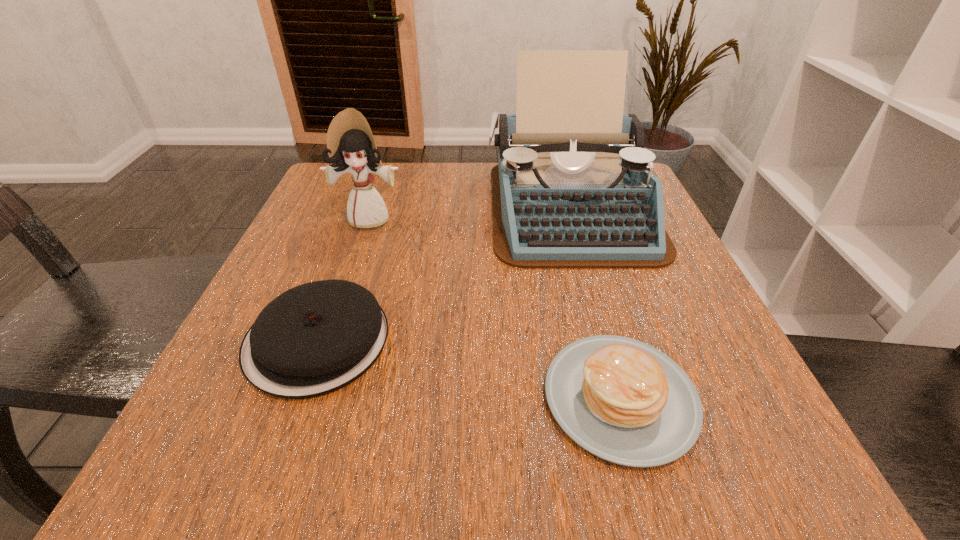
Find the location of a particular element. The image size is (960, 540). typewriter is located at coordinates coord(573,188).

Where is `the third shortest object`? the third shortest object is located at coordinates (350, 144).

The width and height of the screenshot is (960, 540). I want to click on the third tallest object, so click(316, 338).

The width and height of the screenshot is (960, 540). I want to click on the left pancake, so click(x=316, y=338).

Image resolution: width=960 pixels, height=540 pixels. Identify the location of the shortest object. (624, 401).

Locate an element on the screen. the right pancake is located at coordinates (624, 401).

You are a GUI agent. You are given a task and a screenshot of the screen. Output one action in this format:
    pyautogui.click(x=<x>, y=<y>)
    Task: Click on the free region located 0.100m on the typing side of the typewriter
    This screenshot has height=540, width=960.
    Given the screenshot: What is the action you would take?
    click(x=598, y=307)

In order to click on vacant space located 0.300m at the front face of the third shortest object in this screenshot , I will do `click(327, 346)`.

I want to click on free space located on the back of the second shortest object, so [x=342, y=273].

Locate an element on the screen. free region located on the back of the shortest object is located at coordinates (571, 220).